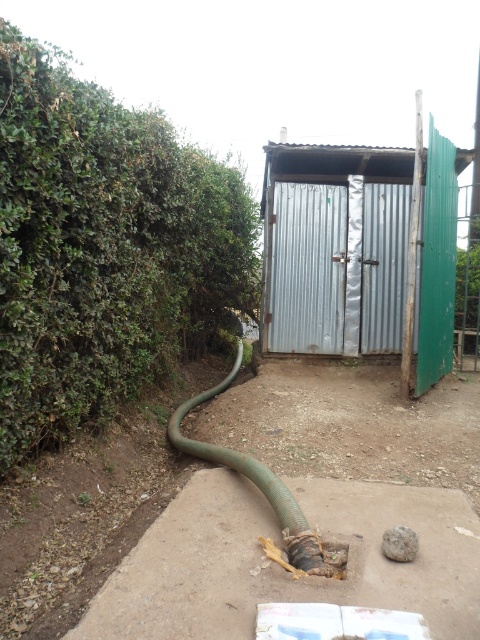
Question: Does metallic corrugated hut at center have a smaller size compared to gray rough stone at lower center?

Choices:
 (A) yes
 (B) no

Answer: (B)

Question: Among these objects, which one is farthest from the camera?

Choices:
 (A) green rubber hose at center
 (B) green leafy hedge at left
 (C) gray rough stone at lower center

Answer: (B)

Question: Which of these objects is positioned farthest from the gray rough stone at lower center?

Choices:
 (A) metallic corrugated hut at center
 (B) green leafy hedge at left
 (C) green rubber hose at center

Answer: (A)

Question: Which point is farther to the camera?

Choices:
 (A) (389, 554)
 (B) (182, 444)

Answer: (B)

Question: Does metallic corrugated hut at center appear on the left side of gray rough stone at lower center?

Choices:
 (A) no
 (B) yes

Answer: (A)

Question: Where is green leafy hedge at left located in relation to metallic corrugated hut at center in the image?

Choices:
 (A) below
 (B) above

Answer: (A)